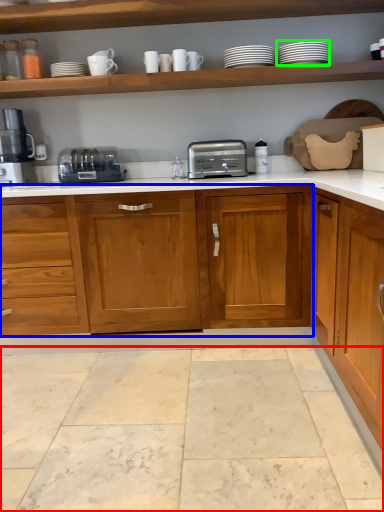
Question: Based on their relative distances, which object is nearer to granite (highlighted by a red box)? Choose from cabinetry (highlighted by a blue box) and tableware (highlighted by a green box).

Choices:
 (A) cabinetry
 (B) tableware

Answer: (A)